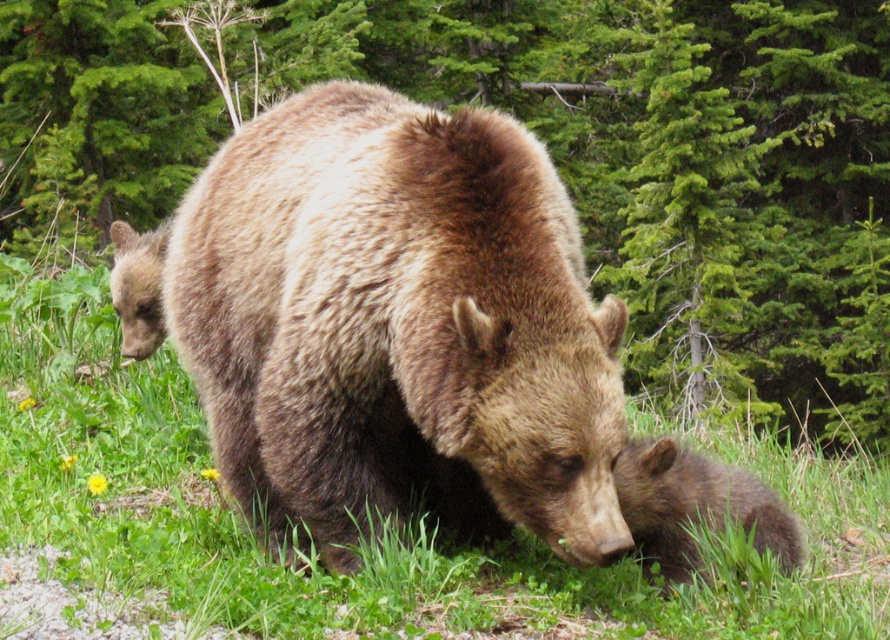
Question: Which point is closer to the camera?

Choices:
 (A) (807, 240)
 (B) (427, 120)

Answer: (B)

Question: Which of the following is the closest to the observer?

Choices:
 (A) (209, 340)
 (B) (737, 371)

Answer: (A)

Question: Is green leafy tree at upper center to the left of brown furry bear at center from the viewer's perspective?

Choices:
 (A) yes
 (B) no

Answer: (B)

Question: Which point is closer to the camera taking this photo?

Choices:
 (A) (446, 376)
 (B) (883, 449)

Answer: (A)

Question: Can you confirm if green leafy tree at upper center is positioned to the right of brown furry bear at center?

Choices:
 (A) no
 (B) yes

Answer: (B)

Question: Is green leafy tree at upper center smaller than brown furry bear at center?

Choices:
 (A) yes
 (B) no

Answer: (B)